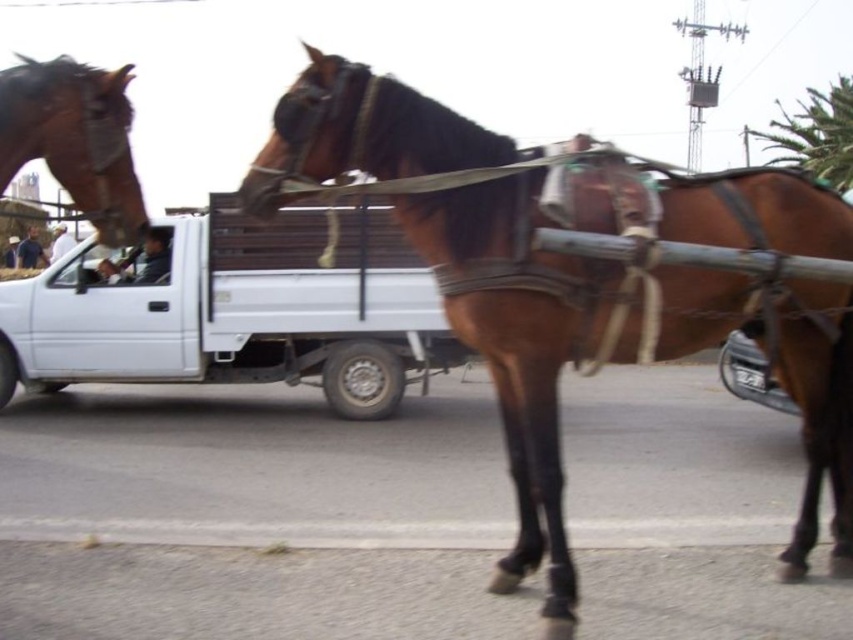
You are a delivery person driving a white matte truck at center and need to pass a brown glossy horse at upper left pulling a cart. Given the distance between them is 5.33 meters, can you safely overtake the horse and cart without coming closer than 3 meters?

The distance between the white matte truck at center and the brown glossy horse at upper left is 5.33 meters. Since the required safety distance is 3 meters, the truck can safely overtake the horse as the existing distance is greater than the minimum required.

You are a photographer trying to capture the two horses pulling the cart. You want to arrange your photo such that the brown glossy horse at center and the brown glossy horse at upper left are both visible. Based on their positions, which horse should be placed on the left side of the photo?

The brown glossy horse at upper left should be placed on the left side of the photo since the brown glossy horse at center is positioned on the right side of it.

You are standing on the road and see two points marked on the ground. The first point is at position point (589, 349) and the second is at point (368, 273). Which point is closer to you if you are facing the direction the horses are pulling the cart?

Point (589, 349) is in front of point (368, 273), so if you are facing the direction the horses are pulling the cart, the point (589, 349) is closer to you.